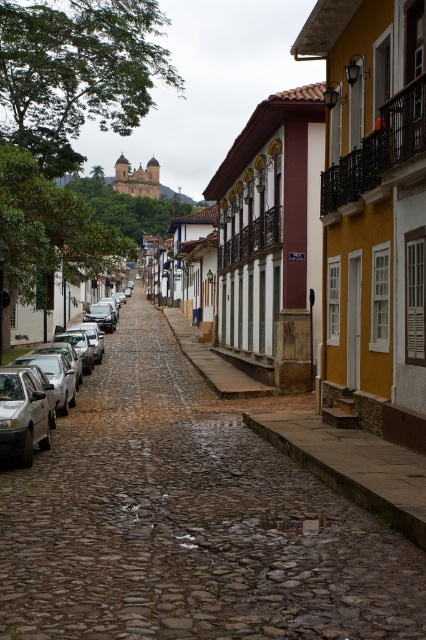
Question: Is cobblestone alley at center below silver metallic car at left?

Choices:
 (A) yes
 (B) no

Answer: (A)

Question: Which object is positioned closest to the silver metallic car at left?

Choices:
 (A) cobblestone alley at center
 (B) yellow painted wall at right

Answer: (A)

Question: Is cobblestone alley at center closer to camera compared to silver metallic car at left?

Choices:
 (A) yes
 (B) no

Answer: (A)

Question: Which is farther from the silver metallic car at left?

Choices:
 (A) cobblestone alley at center
 (B) yellow painted wall at right

Answer: (B)

Question: Is cobblestone alley at center above silver metallic car at left?

Choices:
 (A) no
 (B) yes

Answer: (A)

Question: Among these objects, which one is farthest from the camera?

Choices:
 (A) cobblestone alley at center
 (B) silver metallic car at left
 (C) yellow painted wall at right

Answer: (B)